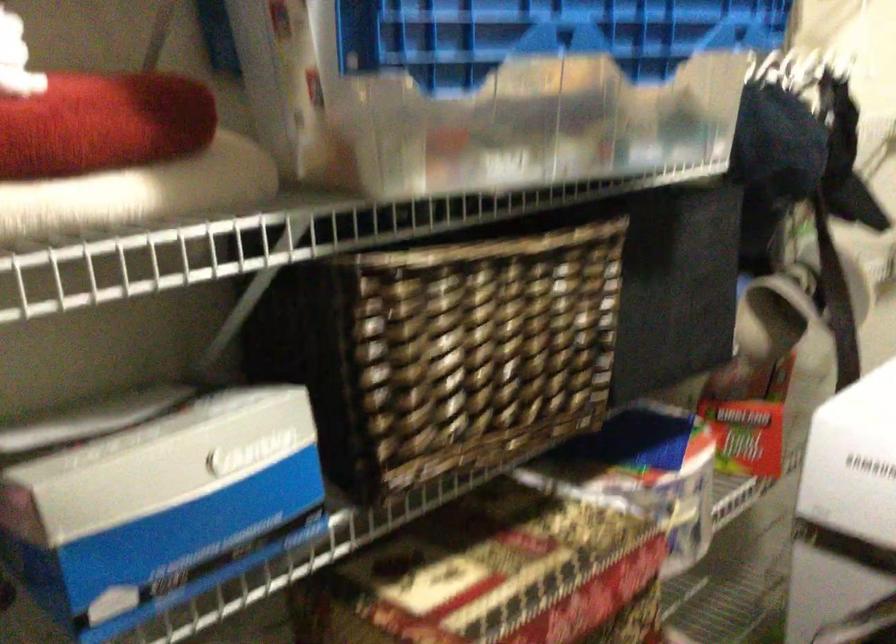
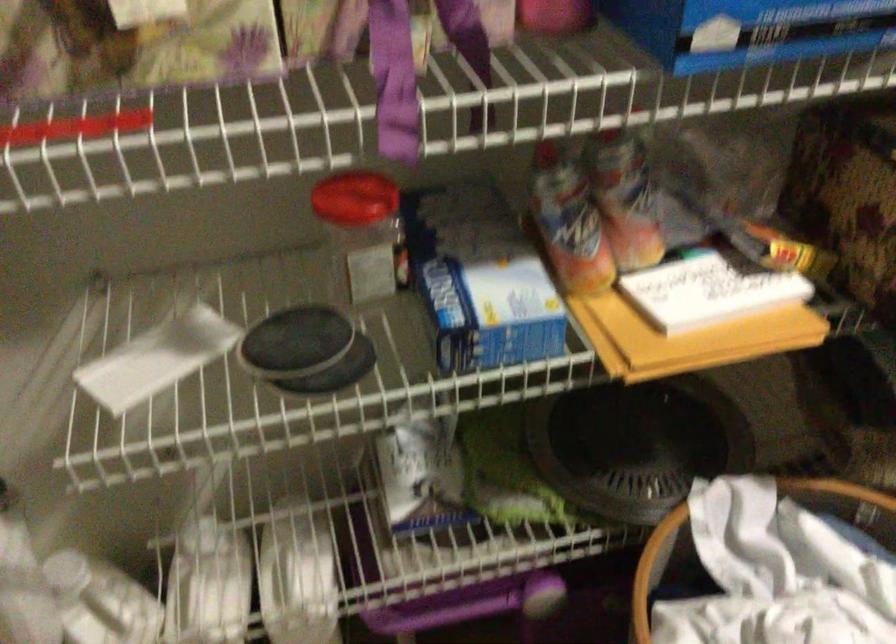
The images are taken continuously from a first-person perspective. In which direction is your viewpoint rotating?

The camera's rotation is toward left-down.